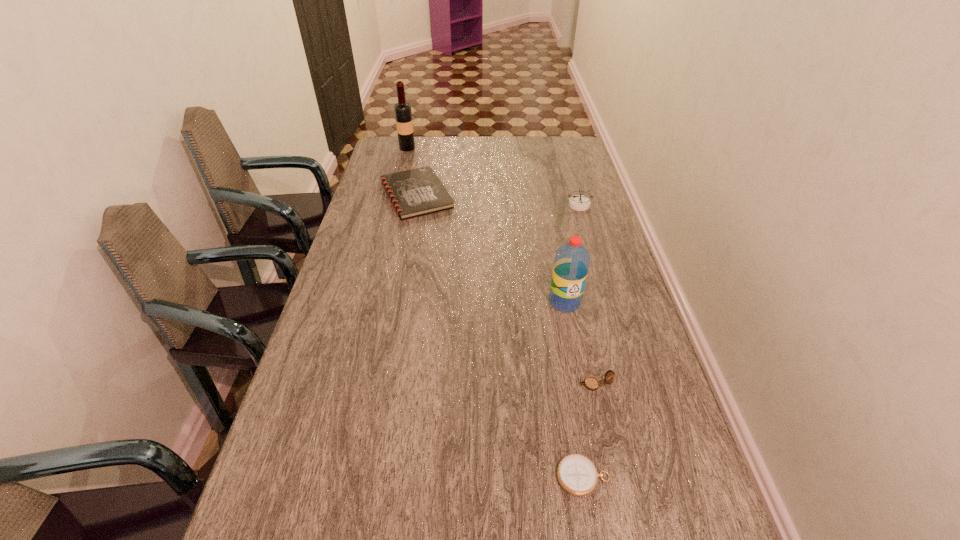
I want to click on the nearest compass, so click(x=577, y=475).

Locate an element on the screen. The height and width of the screenshot is (540, 960). vacant space positioned on the right of the wine bottle is located at coordinates (505, 148).

In order to click on free space located on the front label of the fifth shortest object in this screenshot , I will do `click(573, 348)`.

The width and height of the screenshot is (960, 540). Find the location of `free space located 0.100m on the left of the rightmost compass`. free space located 0.100m on the left of the rightmost compass is located at coordinates (540, 205).

Identify the location of free point located 0.240m on the face of the second tallest compass. (478, 384).

The height and width of the screenshot is (540, 960). I want to click on free location located on the face of the second tallest compass, so click(548, 384).

The width and height of the screenshot is (960, 540). What are the coordinates of `free space located 0.100m on the face of the second tallest compass` in the screenshot? It's located at (536, 384).

I want to click on vacant space situated 0.100m on the right of the second shortest object, so [x=481, y=195].

At what (x,y) coordinates should I click in order to perform the action: click on vacant space located on the back of the shortest compass. Please return your answer as a coordinate pair (x, y). Looking at the image, I should click on (573, 418).

What are the coordinates of `object positioned at the far edge` in the screenshot? It's located at (403, 114).